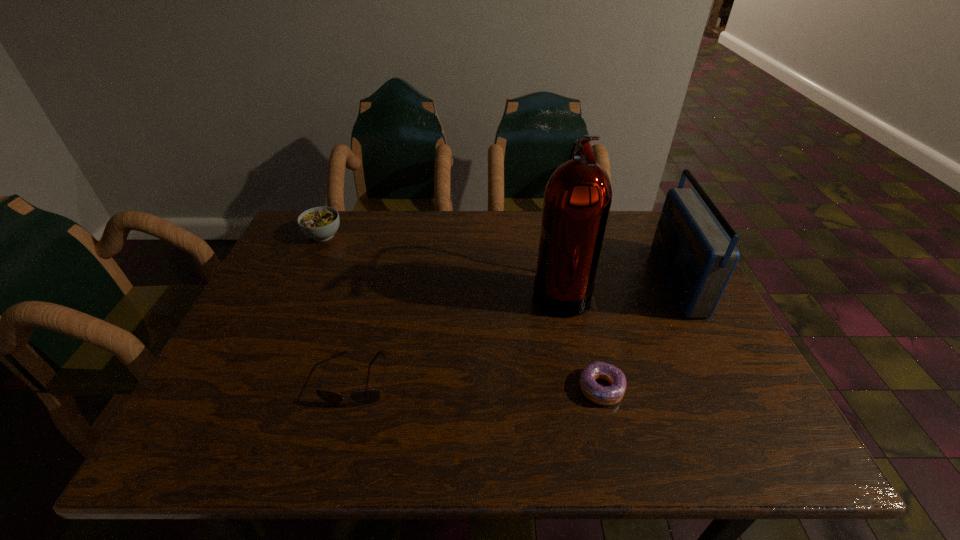
At what (x,y) coordinates should I click in order to perform the action: click on the tallest object. Please return your answer as a coordinate pair (x, y). Looking at the image, I should click on (577, 200).

Identify the location of radio receiver. (697, 258).

I want to click on the rightmost object, so click(697, 258).

Locate an element on the screen. the third shortest object is located at coordinates (319, 223).

The height and width of the screenshot is (540, 960). What are the coordinates of `the leftmost object` in the screenshot? It's located at (319, 223).

Image resolution: width=960 pixels, height=540 pixels. Identify the location of the fourth object from right to left. (366, 397).

Where is `the second shortest object`? Image resolution: width=960 pixels, height=540 pixels. the second shortest object is located at coordinates (366, 397).

The height and width of the screenshot is (540, 960). Identify the location of the shortest object. (603, 395).

The height and width of the screenshot is (540, 960). I want to click on vacant space located 0.320m on the front-facing side of the fire extinguisher, so click(x=409, y=290).

You are a GUI agent. You are given a task and a screenshot of the screen. Output one action in this format:
    pyautogui.click(x=<x>, y=<y>)
    Task: Click on the free region located 0.130m on the front-facing side of the fire extinguisher
    
    Given the screenshot: What is the action you would take?
    pyautogui.click(x=482, y=290)